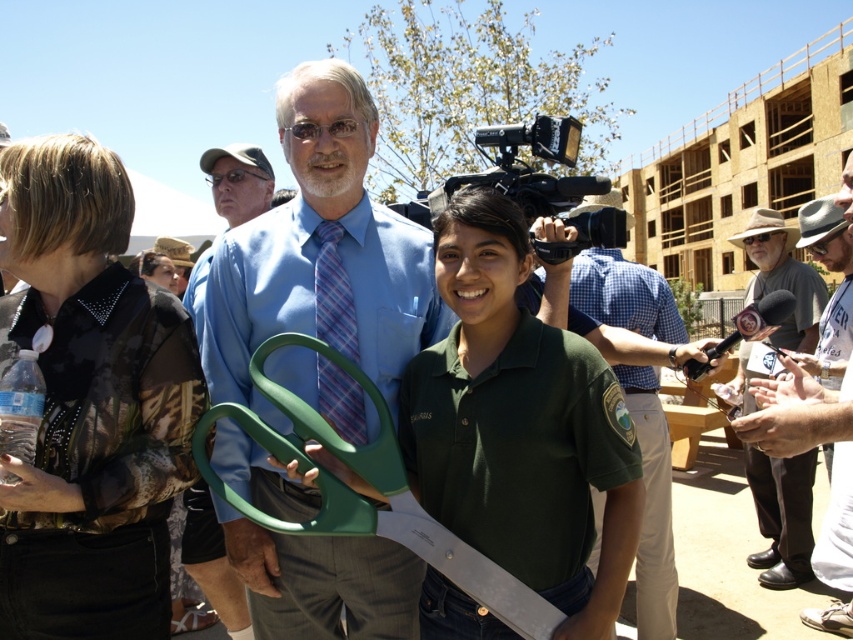
Question: Is blue shirt at center below blue fabric shirt at upper center?

Choices:
 (A) no
 (B) yes

Answer: (A)

Question: Based on their relative distances, which object is nearer to the gray felt hat at right?

Choices:
 (A) green plastic scissors at center
 (B) matte green scissors at center
 (C) blue fabric shirt at upper center

Answer: (A)

Question: Is gray felt hat at right wider than blue fabric shirt at upper center?

Choices:
 (A) no
 (B) yes

Answer: (B)

Question: Is green plastic scissors at center below blue shirt at center?

Choices:
 (A) no
 (B) yes

Answer: (A)

Question: Which point appears closest to the camera in this image?

Choices:
 (A) (155, 609)
 (B) (202, 570)
 (C) (231, 314)

Answer: (A)

Question: Which point is closer to the camera taking this photo?

Choices:
 (A) (399, 624)
 (B) (207, 557)

Answer: (A)